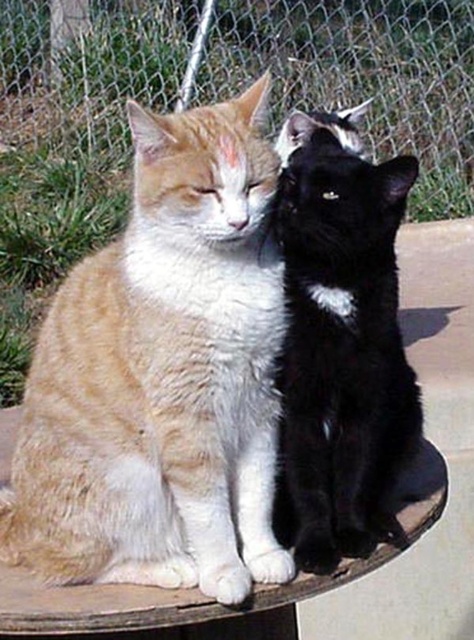
Question: Based on their relative distances, which object is farther from the metal mesh fence at upper center?

Choices:
 (A) tabby fur cat at center
 (B) black glossy cat at center
 (C) wooden table at center

Answer: (C)

Question: Estimate the real-world distances between objects in this image. Which object is closer to the wooden table at center?

Choices:
 (A) black glossy cat at center
 (B) metal mesh fence at upper center

Answer: (A)

Question: Can you confirm if metal mesh fence at upper center is thinner than black glossy cat at center?

Choices:
 (A) yes
 (B) no

Answer: (B)

Question: Is tabby fur cat at center below wooden table at center?

Choices:
 (A) yes
 (B) no

Answer: (B)

Question: Is tabby fur cat at center smaller than wooden table at center?

Choices:
 (A) yes
 (B) no

Answer: (B)

Question: Which point is closer to the camera?

Choices:
 (A) (446, 61)
 (B) (437, 497)
 (C) (100, 525)
 (D) (397, 364)

Answer: (C)